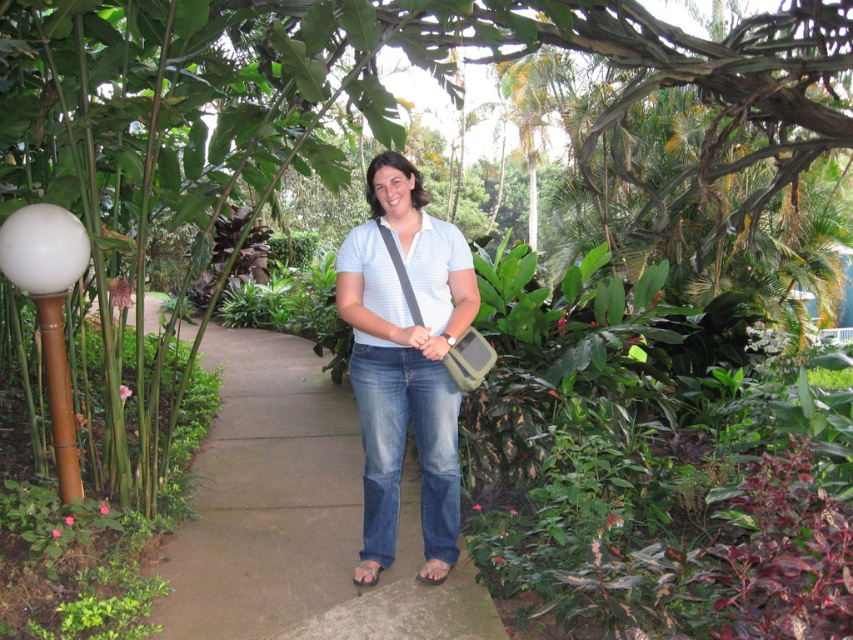
You are a photographer trying to capture a clear shot of the gray concrete pavement at center. The person wearing the white striped shirt at center is blocking your view. Can you move the person to the right to get an unobstructed view of the pavement?

Yes, moving the white striped shirt at center to the right would allow the gray concrete pavement at center to be visible since it is currently to the left of the shirt.

You are planning to walk along the gray concrete pavement at center while carrying a large backpack. Considering the presence of the white glossy ball at left, will there be enough space for you to pass through without touching the ball?

The gray concrete pavement at center is wider than the white glossy ball at left, so there should be sufficient space to walk along the pavement without touching the ball.

You are a photographer trying to capture the perfect shot of the white striped shirt at center and the white glossy ball at left. Based on their positions, which object should you focus on first if you want to frame them both in a single shot without moving your camera?

The white glossy ball at left is to the left of the white striped shirt at center, so you should focus on the white glossy ball at left first to ensure both objects are within the frame.